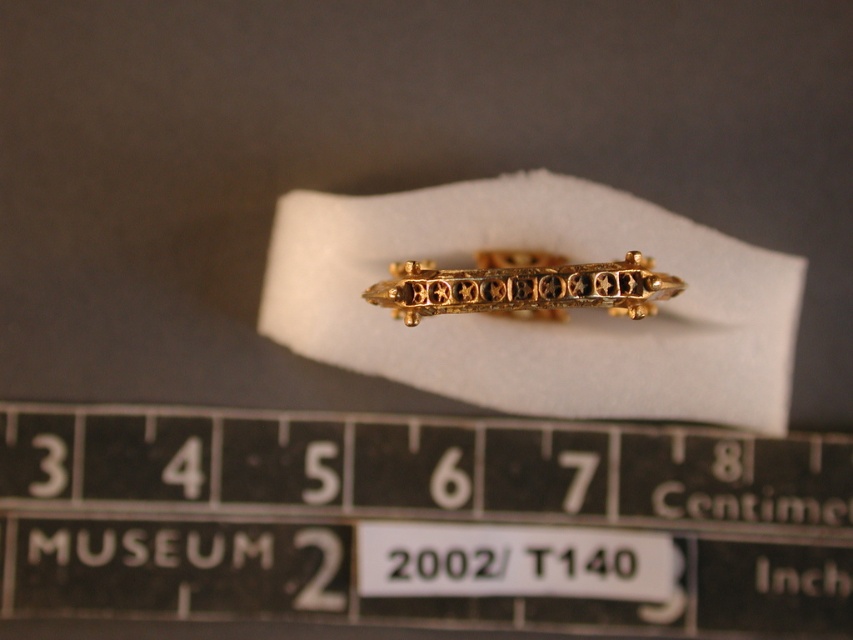
Can you confirm if metallic black ruler at center is bigger than goldmaterial/texture ring at center?

Correct, metallic black ruler at center is larger in size than goldmaterial/texture ring at center.

Does metallic black ruler at center have a greater width compared to goldmaterial/texture ring at center?

Correct, the width of metallic black ruler at center exceeds that of goldmaterial/texture ring at center.

Describe the element at coordinates (422, 520) in the screenshot. I see `metallic black ruler at center` at that location.

Identify the location of metallic black ruler at center. The width and height of the screenshot is (853, 640). (422, 520).